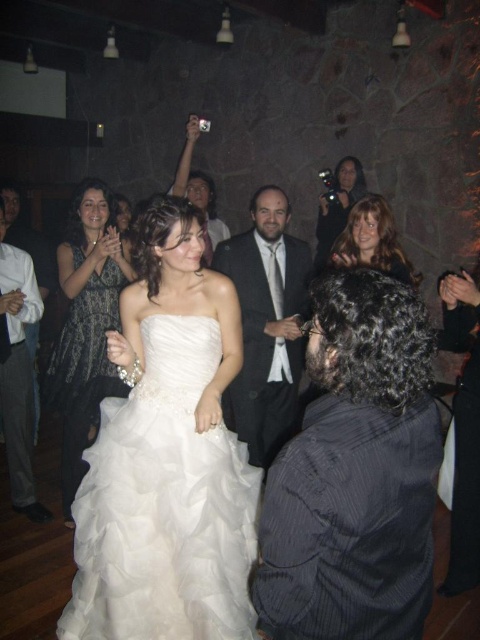
Question: Can you confirm if white satin suit at lower left is positioned above matte black camera at upper center?

Choices:
 (A) no
 (B) yes

Answer: (A)

Question: Which is nearer to the smooth brown hair at upper right?

Choices:
 (A) dark gray suit at center
 (B) blonde hair at upper center
 (C) white satin dress at center
 (D) matte black dress at left

Answer: (A)

Question: Can you confirm if dark gray suit at center is bigger than smooth brown hair at upper right?

Choices:
 (A) no
 (B) yes

Answer: (B)

Question: Which object appears closest to the camera in this image?

Choices:
 (A) white satin dress at center
 (B) white satin suit at lower left
 (C) blonde hair at upper center

Answer: (A)

Question: Which point is closer to the camera?

Choices:
 (A) dark gray textured dress at upper left
 (B) white satin dress at center

Answer: (B)

Question: Is white satin dress at center bigger than dark gray suit at center?

Choices:
 (A) yes
 (B) no

Answer: (A)